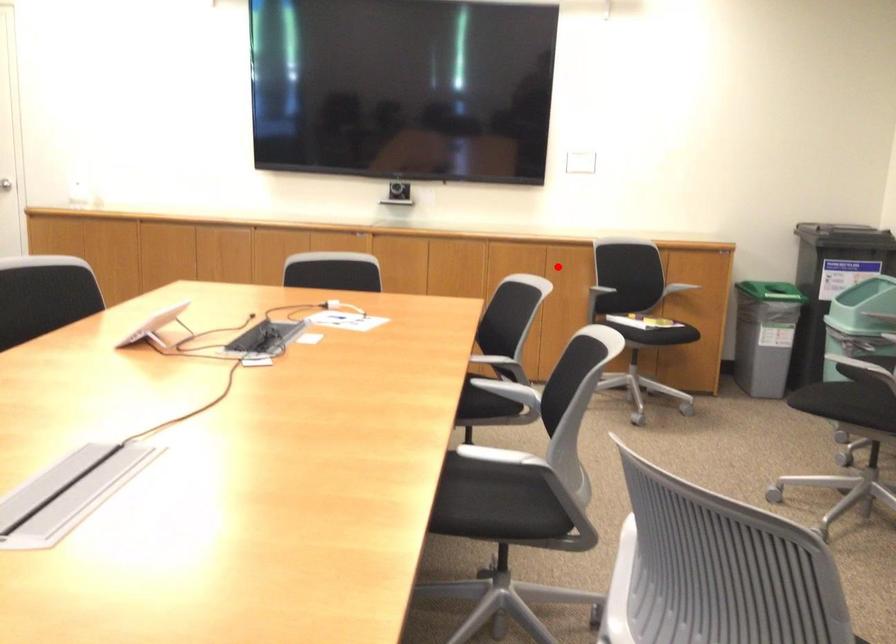
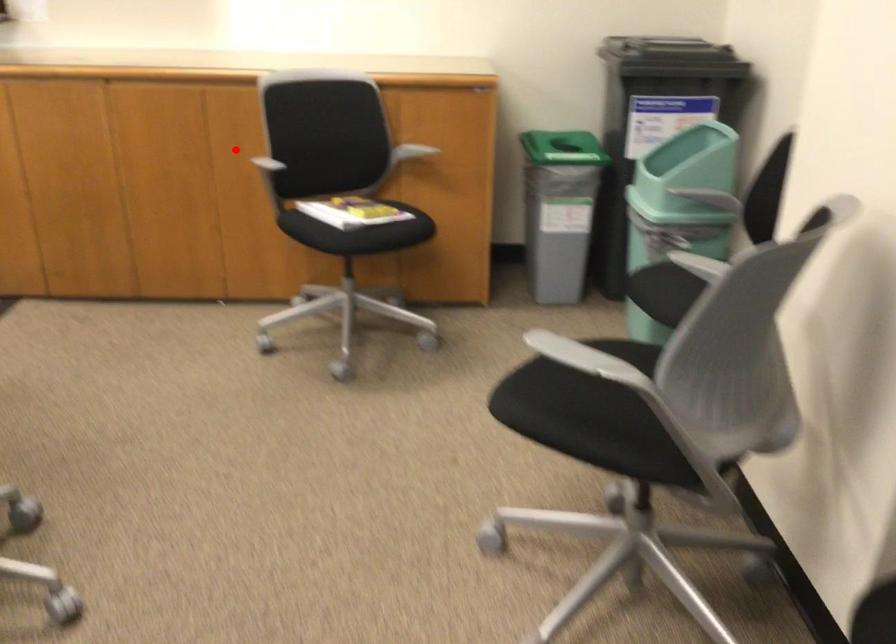
I am providing you with two images of the same scene from different viewpoints. A red point is marked on the first image and another point is marked on the second image. Is the marked point in image1 the same physical position as the marked point in image2?

Yes